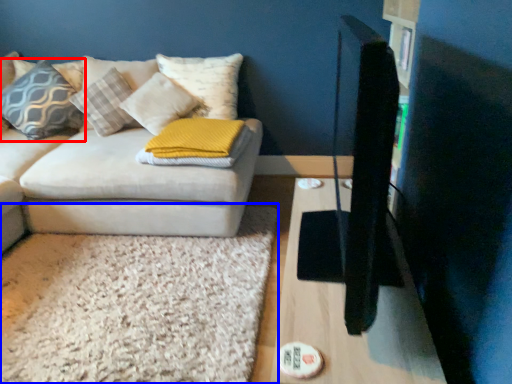
Question: Which point is further to the camera, pillow (highlighted by a red box) or mat (highlighted by a blue box)?

Choices:
 (A) pillow
 (B) mat

Answer: (A)